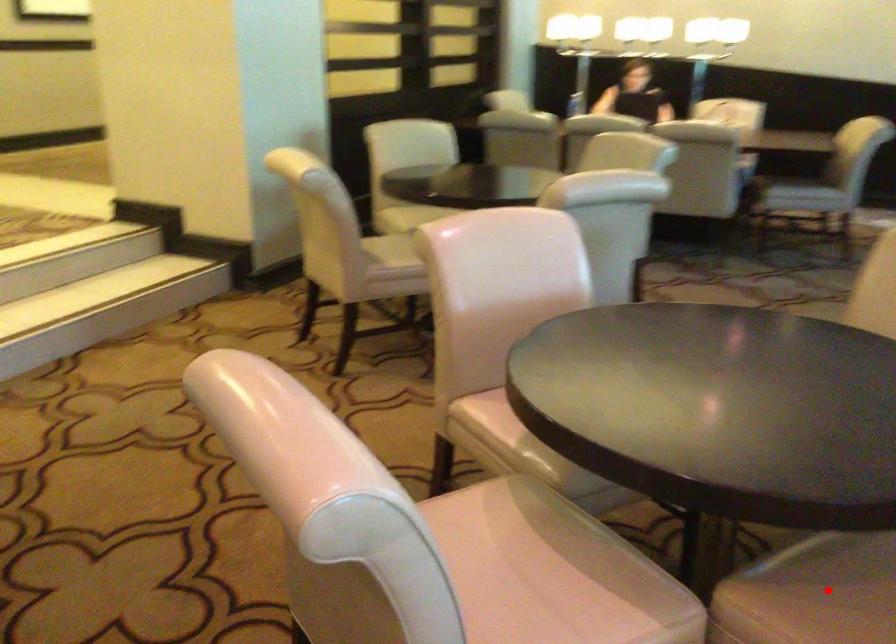
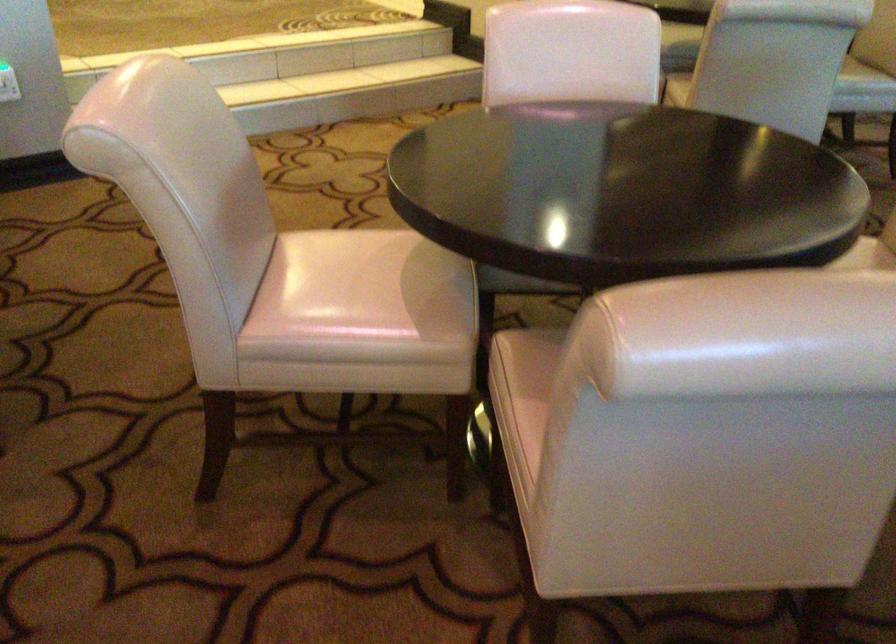
Question: I am providing you with two images of the same scene from different viewpoints. A red point is marked on the first image. Can you still see the location of the red point in image 2?

Choices:
 (A) Yes
 (B) No

Answer: (B)